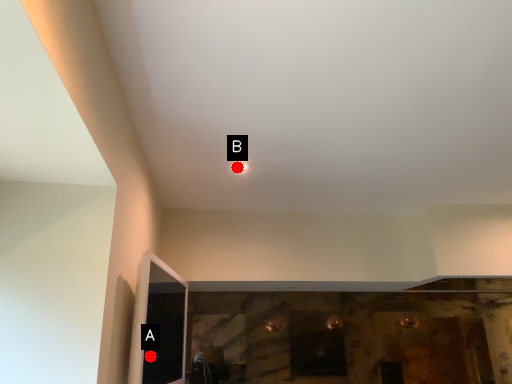
Question: Two points are circled on the image, labeled by A and B beside each circle. Which point is closer to the camera?

Choices:
 (A) A is closer
 (B) B is closer

Answer: (A)